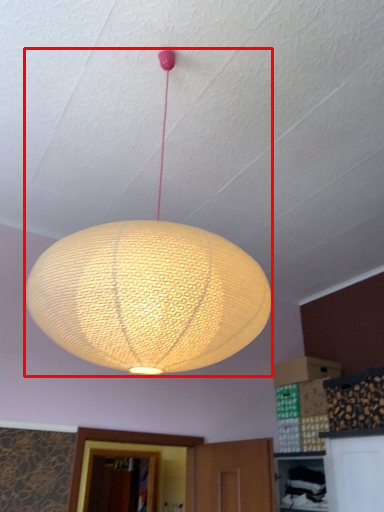
Question: From the image's perspective, where is lamp (annotated by the red box) located in relation to lantern in the image?

Choices:
 (A) above
 (B) below

Answer: (A)